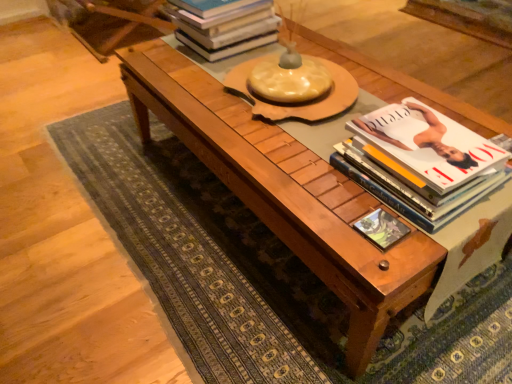
Find the location of a particular element. The width and height of the screenshot is (512, 384). vacant region to the right of matte green book at center is located at coordinates (437, 231).